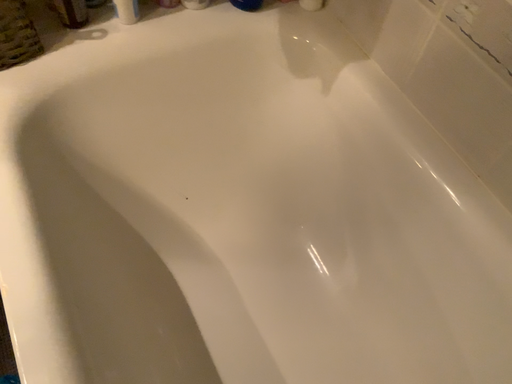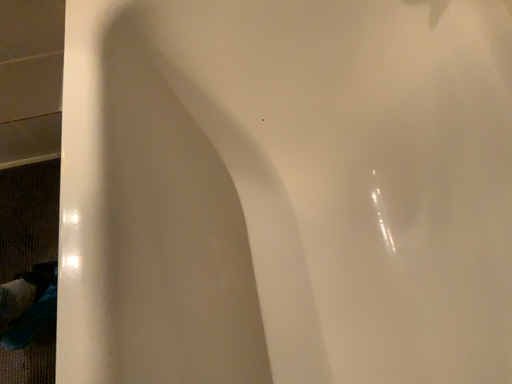
Question: How did the camera likely rotate when shooting the video?

Choices:
 (A) rotated upward
 (B) rotated downward

Answer: (B)